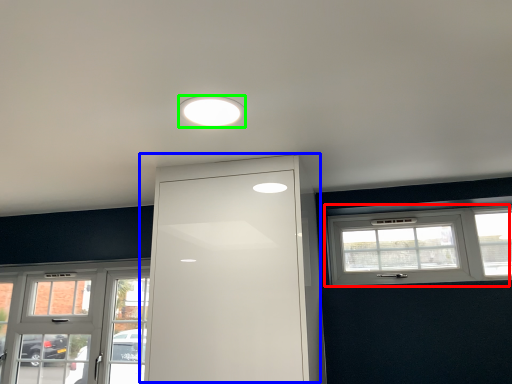
Question: Based on their relative distances, which object is farther from window (highlighted by a red box)? Choose from door (highlighted by a blue box) and lighting (highlighted by a green box).

Choices:
 (A) door
 (B) lighting

Answer: (B)